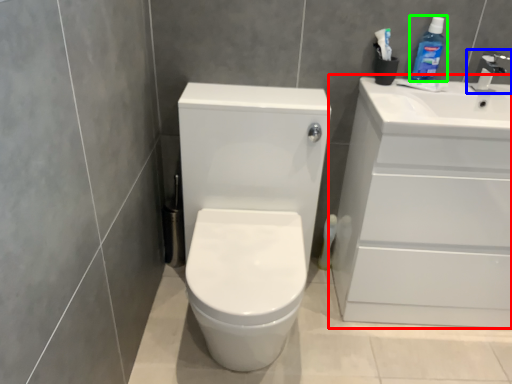
Question: Estimate the real-world distances between objects in this image. Which object is farther from bathroom cabinet (highlighted by a red box), tap (highlighted by a blue box) or cleaning product (highlighted by a green box)?

Choices:
 (A) tap
 (B) cleaning product

Answer: (A)